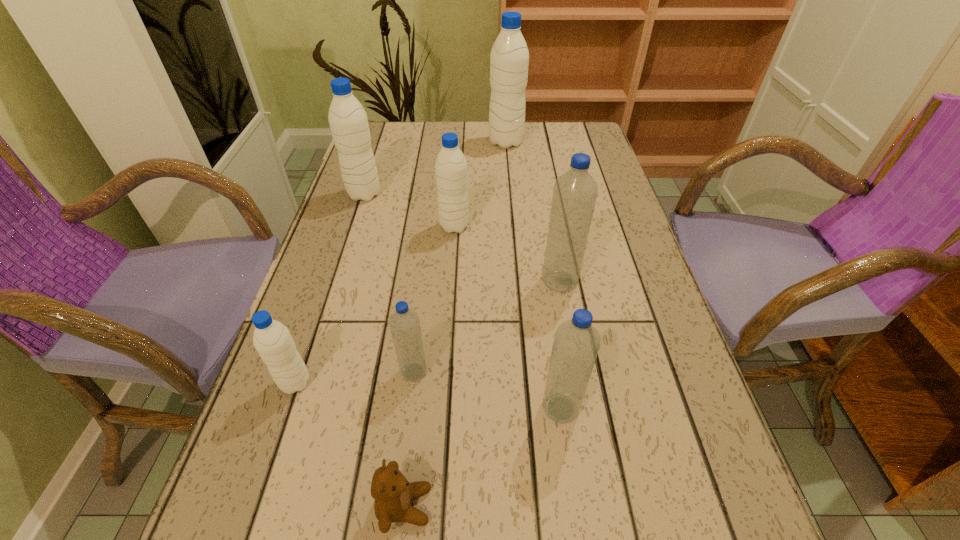
Where is `the biggest gray water bottle`? the biggest gray water bottle is located at coordinates (509, 59).

Where is `the rightmost gray water bottle`? Image resolution: width=960 pixels, height=540 pixels. the rightmost gray water bottle is located at coordinates (509, 59).

Find the location of a particular element. The width and height of the screenshot is (960, 540). the seventh nearest object is located at coordinates (348, 121).

I want to click on the second farthest gray water bottle, so click(348, 121).

This screenshot has width=960, height=540. Find the location of `the farthest blue water bottle`. the farthest blue water bottle is located at coordinates (575, 192).

I want to click on the biggest blue water bottle, so click(x=575, y=192).

You are a GUI agent. You are given a task and a screenshot of the screen. Output one action in this format:
    pyautogui.click(x=<x>, y=<y>)
    Task: Click on the third biggest gray water bottle
    The width and height of the screenshot is (960, 540).
    Given the screenshot: What is the action you would take?
    pyautogui.click(x=451, y=172)

The height and width of the screenshot is (540, 960). What are the coordinates of `the third farthest gray water bottle` in the screenshot? It's located at (451, 172).

Image resolution: width=960 pixels, height=540 pixels. Find the location of `the nearest blue water bottle`. the nearest blue water bottle is located at coordinates (576, 343).

At what (x,y) coordinates should I click in order to perform the action: click on the leftmost blue water bottle. Please return your answer as a coordinate pair (x, y). The height and width of the screenshot is (540, 960). Looking at the image, I should click on (404, 323).